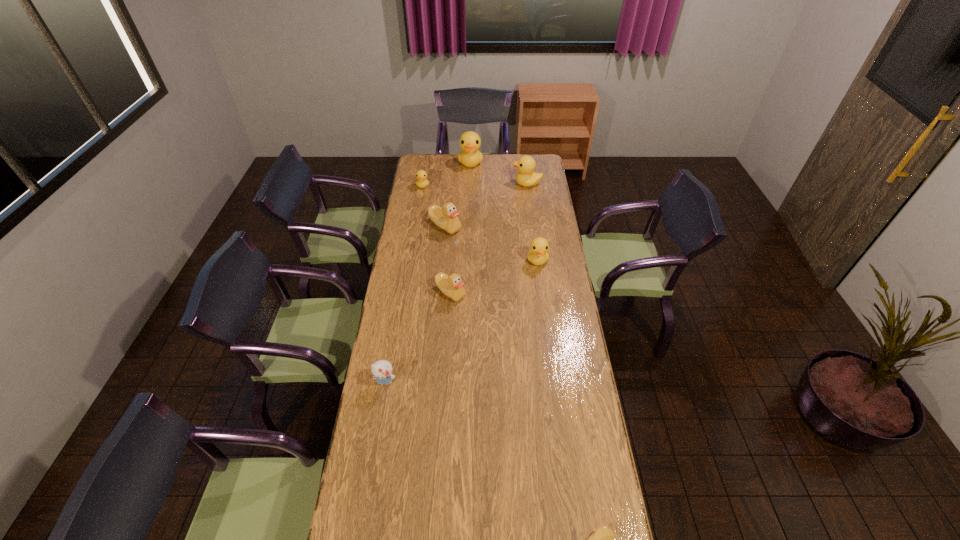
Identify which object is the fourth nearest to the nearest beige duck. Please provide its 2D coordinates. Your answer should be formatted as a tuple, i.e. [(x, y)], where the tuple contains the x and y coordinates of a point satisfying the conditions above.

[(446, 218)]

Identify which object is the fourth nearest to the second farthest beige duck. Please provide its 2D coordinates. Your answer should be formatted as a tuple, i.e. [(x, y)], where the tuple contains the x and y coordinates of a point satisfying the conditions above.

[(421, 175)]

Locate which duck is the closest to the leftmost duck. Please provide its 2D coordinates. Your answer should be formatted as a tuple, i.e. [(x, y)], where the tuple contains the x and y coordinates of a point satisfying the conditions above.

[(470, 156)]

You are a GUI agent. You are given a task and a screenshot of the screen. Output one action in this format:
    pyautogui.click(x=<x>, y=<y>)
    Task: Click on the fourth closest duck to the fourth nearest object
    This screenshot has width=960, height=540.
    Given the screenshot: What is the action you would take?
    pyautogui.click(x=421, y=175)

Identify which yellow duck is the second nearest to the third smallest yellow duck. Please provide its 2D coordinates. Your answer should be formatted as a tuple, i.e. [(x, y)], where the tuple contains the x and y coordinates of a point satisfying the conditions above.

[(421, 175)]

Select which yellow duck appears as the third closest to the second biggest yellow duck. Please provide its 2D coordinates. Your answer should be formatted as a tuple, i.e. [(x, y)], where the tuple contains the x and y coordinates of a point satisfying the conditions above.

[(538, 255)]

Locate which beige duck ranks third in proximity to the leftmost duck. Please provide its 2D coordinates. Your answer should be formatted as a tuple, i.e. [(x, y)], where the tuple contains the x and y coordinates of a point satisfying the conditions above.

[(602, 539)]

Identify which beige duck is the second nearest to the smallest yellow duck. Please provide its 2D coordinates. Your answer should be formatted as a tuple, i.e. [(x, y)], where the tuple contains the x and y coordinates of a point satisfying the conditions above.

[(452, 286)]

Image resolution: width=960 pixels, height=540 pixels. I want to click on vacant space that satisfies the following two spatial constraints: 1. on the face of the second biggest yellow duck; 2. at the beak of the second farthest beige duck, so click(541, 293).

Locate an element on the screen. The width and height of the screenshot is (960, 540). vacant point that satisfies the following two spatial constraints: 1. on the face of the third smallest yellow duck; 2. at the beak of the fourth nearest duck is located at coordinates (533, 227).